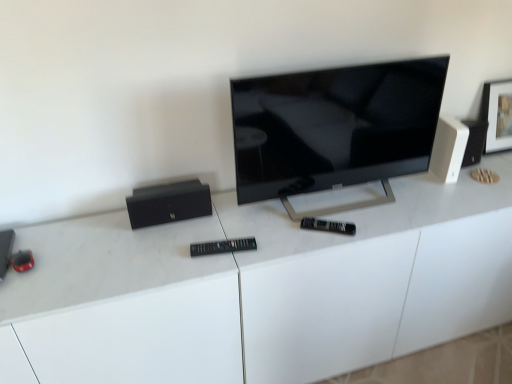
This screenshot has width=512, height=384. Find the location of `white plastic speaker at upper right, the first speaker in the top-to-bottom sequence`. white plastic speaker at upper right, the first speaker in the top-to-bottom sequence is located at coordinates (448, 148).

At what (x,y) coordinates should I click in order to perform the action: click on metallic black speaker at left, marked as the 3th speaker in a top-to-bottom arrangement. Please return your answer as a coordinate pair (x, y). The width and height of the screenshot is (512, 384). Looking at the image, I should click on pyautogui.click(x=5, y=250).

You are a GUI agent. You are given a task and a screenshot of the screen. Output one action in this format:
    pyautogui.click(x=<x>, y=<y>)
    Task: Click on the white glossy desk at center
    The width and height of the screenshot is (512, 384).
    Given the screenshot: What is the action you would take?
    pyautogui.click(x=264, y=288)

The width and height of the screenshot is (512, 384). What do you see at coordinates (222, 246) in the screenshot?
I see `black plastic remote at center` at bounding box center [222, 246].

What do you see at coordinates (335, 129) in the screenshot? This screenshot has width=512, height=384. I see `black glossy tv at center` at bounding box center [335, 129].

Find the location of `white plastic speaker at upper right, the first speaker in the top-to-bottom sequence`. white plastic speaker at upper right, the first speaker in the top-to-bottom sequence is located at coordinates tap(448, 148).

Which object is more forward, black plastic remote at center or black glossy tv at center?

black glossy tv at center is in front.

Where is `television in front of the black plastic remote at center`? television in front of the black plastic remote at center is located at coordinates (335, 129).

From a real-world perspective, between black plastic remote at center and black glossy tv at center, who is vertically higher?

black glossy tv at center is physically above.

Are black plastic remote at center and white plastic speaker at upper right, the 1th speaker when ordered from right to left, far apart?

Actually, black plastic remote at center and white plastic speaker at upper right, the 1th speaker when ordered from right to left, are a little close together.

In terms of width, does black plastic remote at center look wider or thinner when compared to white plastic speaker at upper right, arranged as the 3th speaker when viewed from the left?

Considering their sizes, black plastic remote at center looks slimmer than white plastic speaker at upper right, arranged as the 3th speaker when viewed from the left.

From a real-world perspective, is black plastic remote at center positioned above or below white plastic speaker at upper right, arranged as the 3th speaker when viewed from the left?

From a real-world perspective, black plastic remote at center is physically below white plastic speaker at upper right, arranged as the 3th speaker when viewed from the left.

Is black plastic remote at center oriented towards white plastic speaker at upper right, the 1th speaker when ordered from right to left?

No, black plastic remote at center is not oriented towards white plastic speaker at upper right, the 1th speaker when ordered from right to left.

This screenshot has width=512, height=384. Find the location of `speaker that is below the black matte speaker at left, the 2th speaker from the left (from the image's perspective)`. speaker that is below the black matte speaker at left, the 2th speaker from the left (from the image's perspective) is located at coordinates (5, 250).

Is metallic black speaker at left, marked as the 3th speaker in a top-to-bottom arrangement, aimed at black matte speaker at left, the 2th speaker from the left?

No, metallic black speaker at left, marked as the 3th speaker in a top-to-bottom arrangement, is not turned towards black matte speaker at left, the 2th speaker from the left.

Does metallic black speaker at left, the 1th speaker when ordered from left to right, have a lesser width compared to black matte speaker at left, marked as the second speaker in a bottom-to-top arrangement?

No.

Consider the image. Which is in front, metallic black speaker at left, positioned as the 1th speaker in bottom-to-top order, or black matte speaker at left, acting as the 2th speaker starting from the top?

metallic black speaker at left, positioned as the 1th speaker in bottom-to-top order, is more forward.

From a real-world perspective, is white glossy desk at center physically above metallic black speaker at left, positioned as the 1th speaker in bottom-to-top order?

No, from a real-world perspective, white glossy desk at center is not over metallic black speaker at left, positioned as the 1th speaker in bottom-to-top order

Which speaker is the 1st one when counting from the back of the white glossy desk at center? Please provide its 2D coordinates.

[(5, 250)]

Considering the positions of points (76, 285) and (14, 236), is point (76, 285) closer to camera compared to point (14, 236)?

That is True.

Looking at this image, can you see white glossy desk at center touching metallic black speaker at left, the 1th speaker when ordered from left to right?

white glossy desk at center is not next to metallic black speaker at left, the 1th speaker when ordered from left to right, and they're not touching.

Can you tell me how much white plastic speaker at upper right, the first speaker in the top-to-bottom sequence, and white glossy desk at center differ in facing direction?

The facing directions of white plastic speaker at upper right, the first speaker in the top-to-bottom sequence, and white glossy desk at center are 7.66 degrees apart.

Which object is positioned more to the right, white plastic speaker at upper right, the 1th speaker when ordered from right to left, or white glossy desk at center?

white plastic speaker at upper right, the 1th speaker when ordered from right to left, is more to the right.

Is white plastic speaker at upper right, arranged as the 3th speaker when viewed from the left, surrounding white glossy desk at center?

Actually, white glossy desk at center is outside white plastic speaker at upper right, arranged as the 3th speaker when viewed from the left.

The height and width of the screenshot is (384, 512). In order to click on desk below the white plastic speaker at upper right, the first speaker in the top-to-bottom sequence (from a real-world perspective) in this screenshot , I will do `click(264, 288)`.

From the image's perspective, between white plastic speaker at upper right, arranged as the 3th speaker when viewed from the left, and metallic black speaker at left, marked as the 3th speaker in a top-to-bottom arrangement, who is located below?

From the image's view, metallic black speaker at left, marked as the 3th speaker in a top-to-bottom arrangement, is below.

Is metallic black speaker at left, positioned as the 1th speaker in bottom-to-top order, at the back of white plastic speaker at upper right, the first speaker in the top-to-bottom sequence?

No, white plastic speaker at upper right, the first speaker in the top-to-bottom sequence, is not facing away from metallic black speaker at left, positioned as the 1th speaker in bottom-to-top order.

Is the position of white plastic speaker at upper right, the 1th speaker when ordered from right to left, less distant than that of metallic black speaker at left, positioned as the 1th speaker in bottom-to-top order?

No.

Visually, is white plastic speaker at upper right, arranged as the 3th speaker when viewed from the left, positioned to the left or to the right of metallic black speaker at left, which is the third speaker in right-to-left order?

Clearly, white plastic speaker at upper right, arranged as the 3th speaker when viewed from the left, is on the right of metallic black speaker at left, which is the third speaker in right-to-left order, in the image.

From the image's perspective, which one is positioned higher, metallic black speaker at left, which is the third speaker in right-to-left order, or white glossy desk at center?

metallic black speaker at left, which is the third speaker in right-to-left order.

Does metallic black speaker at left, the 1th speaker when ordered from left to right, have a greater width compared to white glossy desk at center?

In fact, metallic black speaker at left, the 1th speaker when ordered from left to right, might be narrower than white glossy desk at center.

Considering the positions of objects metallic black speaker at left, positioned as the 1th speaker in bottom-to-top order, and white glossy desk at center in the image provided, who is in front, metallic black speaker at left, positioned as the 1th speaker in bottom-to-top order, or white glossy desk at center?

white glossy desk at center is more forward.

From the picture: Does metallic black speaker at left, the 1th speaker when ordered from left to right, touch white glossy desk at center?

No, metallic black speaker at left, the 1th speaker when ordered from left to right, is not in contact with white glossy desk at center.

Find the location of a particular element. The image size is (512, 384). television above the black plastic remote at center (from a real-world perspective) is located at coordinates (335, 129).

Which speaker is the 2nd one when counting from the back of the black plastic remote at center? Please provide its 2D coordinates.

[(448, 148)]

When comparing their distances from black plastic remote at center, does white glossy desk at center or white plastic speaker at upper right, arranged as the 3th speaker when viewed from the left, seem further?

Based on the image, white plastic speaker at upper right, arranged as the 3th speaker when viewed from the left, appears to be further to black plastic remote at center.

Which object lies further to the anchor point metallic black speaker at left, positioned as the 1th speaker in bottom-to-top order, white plastic speaker at upper right, arranged as the 3th speaker when viewed from the left, or black glossy tv at center?

Among the two, white plastic speaker at upper right, arranged as the 3th speaker when viewed from the left, is located further to metallic black speaker at left, positioned as the 1th speaker in bottom-to-top order.

Looking at the image, which one is located further to black matte speaker at left, acting as the 2th speaker starting from the top, white plastic speaker at upper right, arranged as the 3th speaker when viewed from the left, or white glossy desk at center?

The object further to black matte speaker at left, acting as the 2th speaker starting from the top, is white plastic speaker at upper right, arranged as the 3th speaker when viewed from the left.

Estimate the real-world distances between objects in this image. Which object is closer to black matte speaker at left, positioned as the 2th speaker in right-to-left order, metallic black speaker at left, the 1th speaker when ordered from left to right, or black glossy tv at center?

black glossy tv at center is positioned closer to the anchor black matte speaker at left, positioned as the 2th speaker in right-to-left order.

Looking at the image, which one is located further to white plastic speaker at upper right, marked as the third speaker in a bottom-to-top arrangement, black matte speaker at left, positioned as the 2th speaker in right-to-left order, or black glossy tv at center?

Based on the image, black matte speaker at left, positioned as the 2th speaker in right-to-left order, appears to be further to white plastic speaker at upper right, marked as the third speaker in a bottom-to-top arrangement.

When comparing their distances from black plastic remote at center, does black matte speaker at left, marked as the second speaker in a bottom-to-top arrangement, or white plastic speaker at upper right, the 1th speaker when ordered from right to left, seem further?

The object further to black plastic remote at center is white plastic speaker at upper right, the 1th speaker when ordered from right to left.

From the image, which object appears to be farther from black matte speaker at left, marked as the second speaker in a bottom-to-top arrangement, white plastic speaker at upper right, marked as the third speaker in a bottom-to-top arrangement, or black glossy tv at center?

Based on the image, white plastic speaker at upper right, marked as the third speaker in a bottom-to-top arrangement, appears to be further to black matte speaker at left, marked as the second speaker in a bottom-to-top arrangement.

Looking at the image, which one is located closer to black glossy tv at center, white glossy desk at center or black matte speaker at left, the 2th speaker from the left?

white glossy desk at center.

In order to click on desk situated between black matte speaker at left, marked as the second speaker in a bottom-to-top arrangement, and white plastic speaker at upper right, the 1th speaker when ordered from right to left, from left to right in this screenshot , I will do `click(264, 288)`.

You are a GUI agent. You are given a task and a screenshot of the screen. Output one action in this format:
    pyautogui.click(x=<x>, y=<y>)
    Task: Click on the speaker located between metallic black speaker at left, marked as the 3th speaker in a top-to-bottom arrangement, and white plastic speaker at upper right, the 1th speaker when ordered from right to left, in the left-right direction
    The height and width of the screenshot is (384, 512).
    Given the screenshot: What is the action you would take?
    pyautogui.click(x=168, y=203)

You are a GUI agent. You are given a task and a screenshot of the screen. Output one action in this format:
    pyautogui.click(x=<x>, y=<y>)
    Task: Click on the control between metallic black speaker at left, which is the third speaker in right-to-left order, and white glossy desk at center, in the horizontal direction
    The width and height of the screenshot is (512, 384).
    Given the screenshot: What is the action you would take?
    pyautogui.click(x=222, y=246)

I want to click on control located between metallic black speaker at left, which is the third speaker in right-to-left order, and black glossy tv at center in the left-right direction, so tap(222, 246).